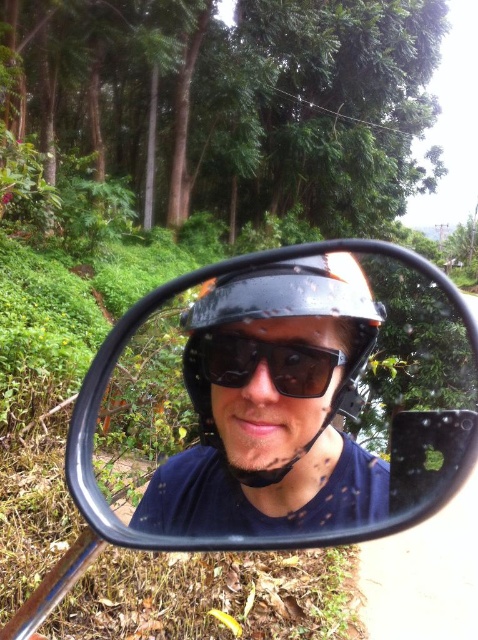
You are riding a motorcycle on a dirt path and looking at the mirror. You see two points marked in the mirror. Which point is closer to you? The points are point at (x=364, y=276) and point at (x=305, y=349).

Point at (x=305, y=349) is closer to you because it is in front of point at (x=364, y=276) in the mirror.

You are a photographer trying to capture the reflection of the person in the black matte mirror at center. If your camera has a maximum focus range of 20 inches, will you be able to clearly capture the reflection?

The black matte mirror at center is 22.22 inches from the viewer, which exceeds the camera maximum focus range of 20 inches. Therefore, the reflection cannot be clearly captured.